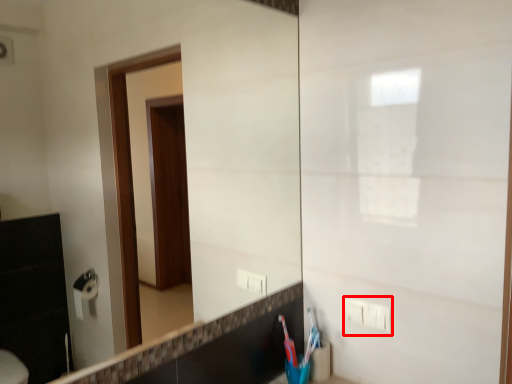
Question: From the image, what is the correct spatial relationship of electric outlet (annotated by the red box) in relation to toothbrush?

Choices:
 (A) left
 (B) right

Answer: (B)